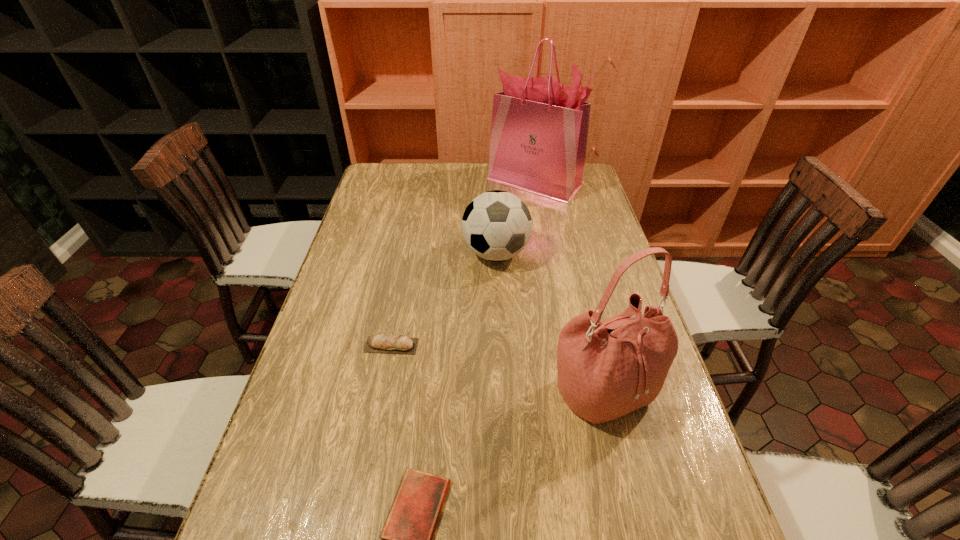
The height and width of the screenshot is (540, 960). I want to click on free point between the soccer ball and the pita bread, so click(444, 299).

Image resolution: width=960 pixels, height=540 pixels. I want to click on vacant area that lies between the tallest object and the fourth tallest object, so click(x=463, y=264).

Identify the location of free spot between the second tallest object and the shopping bag. pos(568,286).

I want to click on unoccupied position between the fourth shortest object and the third tallest object, so click(550, 322).

I want to click on free space that is in between the second shortest object and the farthest object, so click(x=463, y=264).

Select which object is the second closest to the handbag. Please provide its 2D coordinates. Your answer should be formatted as a tuple, i.e. [(x, y)], where the tuple contains the x and y coordinates of a point satisfying the conditions above.

[(496, 225)]

Locate an element on the screen. object that is the second closest one to the handbag is located at coordinates (496, 225).